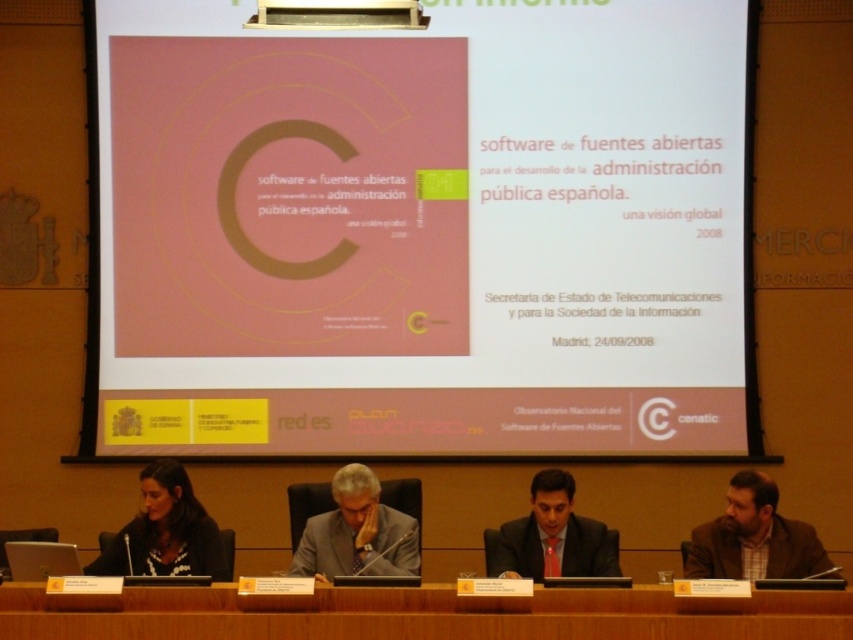
Question: Which object is the farthest from the black fabric at lower left?

Choices:
 (A) brown woolen jacket at lower right
 (B) gray suit at center

Answer: (A)

Question: Which point is farther to the camera?

Choices:
 (A) black fabric at lower left
 (B) brown woolen jacket at lower right

Answer: (A)

Question: Considering the relative positions of pink matte poster at upper center and brown woolen jacket at lower right in the image provided, where is pink matte poster at upper center located with respect to brown woolen jacket at lower right?

Choices:
 (A) left
 (B) right

Answer: (A)

Question: Does brown wooden table at center have a smaller size compared to brown woolen jacket at lower right?

Choices:
 (A) yes
 (B) no

Answer: (A)

Question: Is brown woolen jacket at lower right to the left of black fabric at lower left from the viewer's perspective?

Choices:
 (A) no
 (B) yes

Answer: (A)

Question: Which point is farther to the camera?

Choices:
 (A) gray suit at center
 (B) black fabric at lower left

Answer: (B)